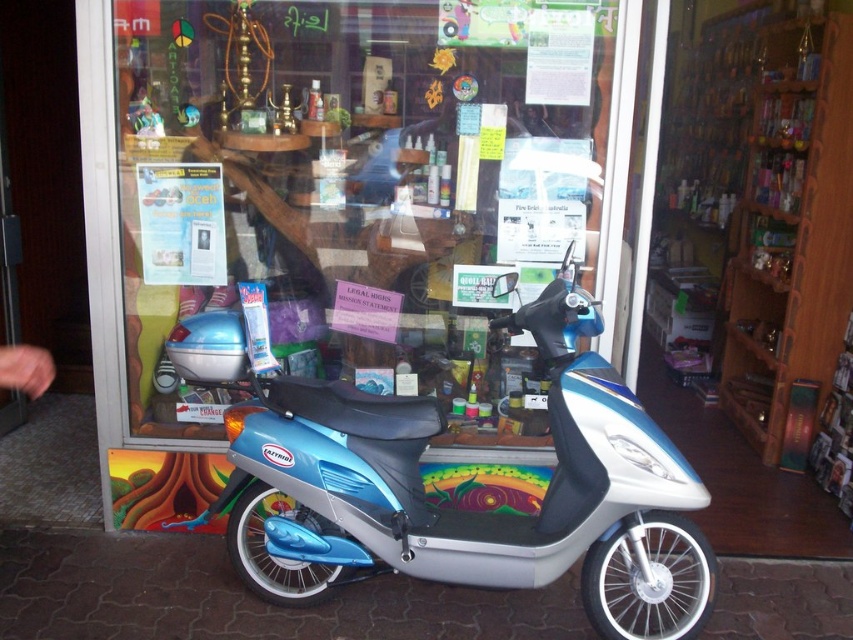
You are a delivery person trying to enter the store through the transparent glass door at center. The metallic blue scooter at center is blocking your path. To reach the door, which direction should you move around the scooter?

The transparent glass door at center is to the left of the metallic blue scooter at center, so you should move to the left side of the metallic blue scooter at center to reach the door.